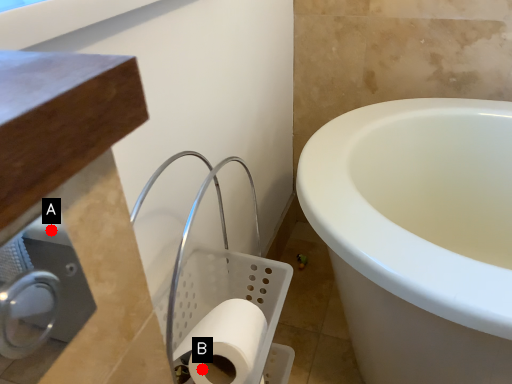
Question: Two points are circled on the image, labeled by A and B beside each circle. Which point appears closest to the camera in this image?

Choices:
 (A) A is closer
 (B) B is closer

Answer: (B)